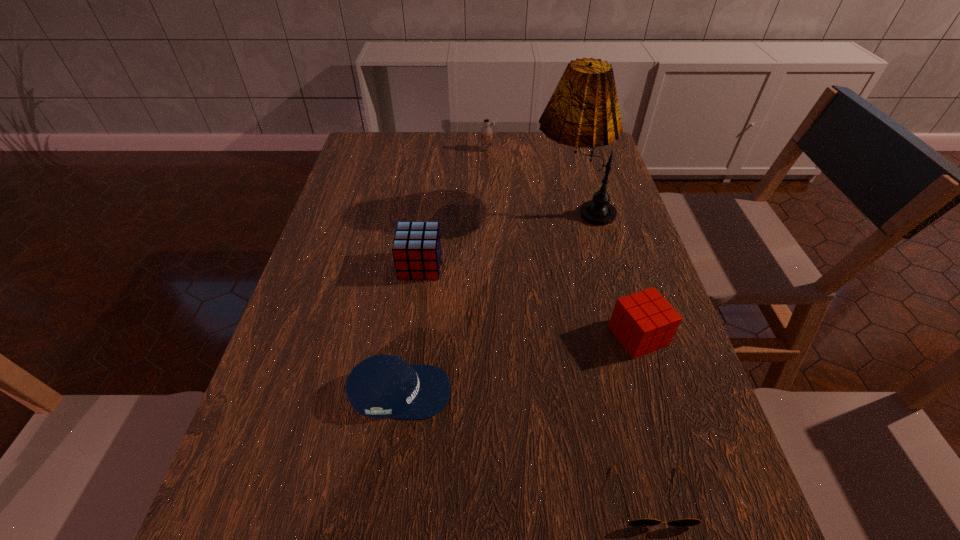
At what (x,y) coordinates should I click in order to perform the action: click on the tallest object. Please return your answer as a coordinate pair (x, y). Looking at the image, I should click on (583, 111).

Where is `the second farthest object`? the second farthest object is located at coordinates [x=583, y=111].

Find the location of a particular element. The height and width of the screenshot is (540, 960). chocolate milk is located at coordinates (486, 132).

Find the location of a particular element. the farthest object is located at coordinates (486, 132).

Find the location of `the farther cube`. the farther cube is located at coordinates (416, 249).

Locate an element on the screen. the third farthest object is located at coordinates (416, 249).

Locate an element on the screen. the fourth farthest object is located at coordinates (643, 322).

You are a GUI agent. You are given a task and a screenshot of the screen. Output one action in this format:
    pyautogui.click(x=<x>, y=<y>)
    Task: Click on the right cube
    Image resolution: width=960 pixels, height=540 pixels.
    Given the screenshot: What is the action you would take?
    pyautogui.click(x=643, y=322)

The width and height of the screenshot is (960, 540). Identify the location of the second nearest object. (381, 386).

Identify the location of the second shortest object. Image resolution: width=960 pixels, height=540 pixels. (381, 386).